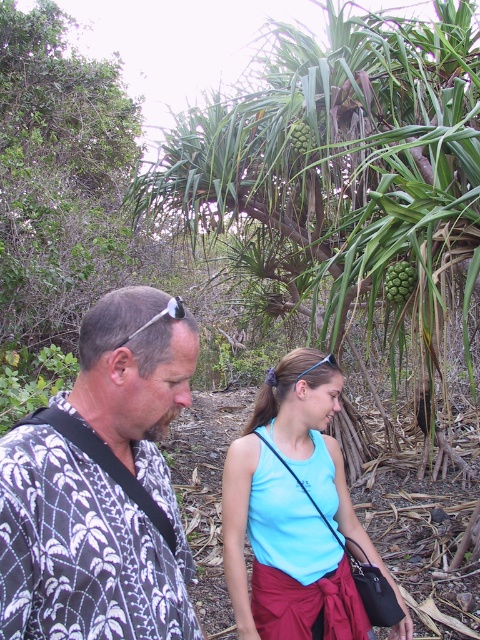
Can you confirm if green leafy tree at center is thinner than printed fabric shirt at left?

No.

Is green leafy tree at center bigger than printed fabric shirt at left?

Yes, green leafy tree at center is bigger than printed fabric shirt at left.

Based on the photo, who is more distant from viewer, (x=288, y=180) or (x=69, y=458)?

The point (x=288, y=180) is more distant.

This screenshot has height=640, width=480. Find the location of `green leafy tree at center`. green leafy tree at center is located at coordinates (348, 180).

Who is lower down, green leafy tree at center or light blue fabric tank top at center?

light blue fabric tank top at center

Which is behind, point (204, 145) or point (249, 472)?

Point (204, 145)

Where is `green leafy tree at center`? Image resolution: width=480 pixels, height=640 pixels. green leafy tree at center is located at coordinates (348, 180).

Which is in front, point (37, 490) or point (308, 413)?

Positioned in front is point (37, 490).

Who is lower down, printed fabric shirt at left or light blue fabric tank top at center?

Positioned lower is light blue fabric tank top at center.

You are a GUI agent. You are given a task and a screenshot of the screen. Output one action in this format:
    pyautogui.click(x=<x>, y=<y>)
    Task: Click on the printed fabric shirt at left
    The image size is (480, 640).
    Given the screenshot: What is the action you would take?
    [x=101, y=486]